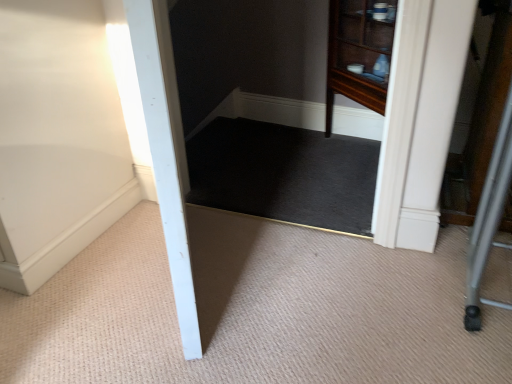
Question: Does black carpet at center appear on the left side of carpet at center?

Choices:
 (A) no
 (B) yes

Answer: (A)

Question: Does black carpet at center have a lesser height compared to carpet at center?

Choices:
 (A) no
 (B) yes

Answer: (B)

Question: Is carpet at center at the back of black carpet at center?

Choices:
 (A) yes
 (B) no

Answer: (A)

Question: Would you say black carpet at center is a long distance from carpet at center?

Choices:
 (A) no
 (B) yes

Answer: (A)

Question: From the image's perspective, is black carpet at center over carpet at center?

Choices:
 (A) yes
 (B) no

Answer: (A)

Question: Is black carpet at center to the right of carpet at center from the viewer's perspective?

Choices:
 (A) yes
 (B) no

Answer: (A)

Question: From a real-world perspective, is carpet at center physically below black carpet at center?

Choices:
 (A) yes
 (B) no

Answer: (A)

Question: Is carpet at center smaller than black carpet at center?

Choices:
 (A) yes
 (B) no

Answer: (B)

Question: From a real-world perspective, does carpet at center stand above black carpet at center?

Choices:
 (A) yes
 (B) no

Answer: (B)

Question: From the image's perspective, would you say carpet at center is shown under black carpet at center?

Choices:
 (A) no
 (B) yes

Answer: (B)

Question: Is carpet at center not within black carpet at center?

Choices:
 (A) yes
 (B) no

Answer: (A)

Question: Is carpet at center oriented away from black carpet at center?

Choices:
 (A) no
 (B) yes

Answer: (A)

Question: From the image's perspective, relative to carpet at center, is black carpet at center above or below?

Choices:
 (A) above
 (B) below

Answer: (A)